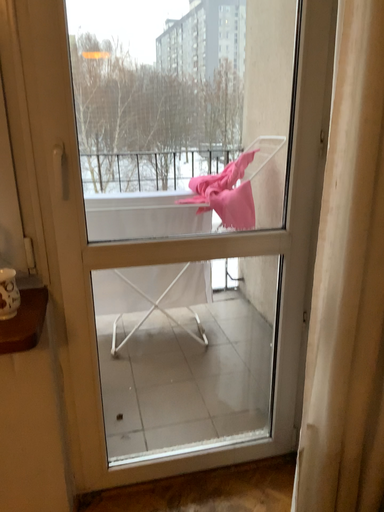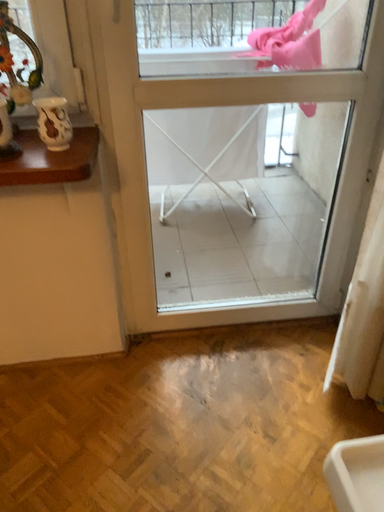
Question: How did the camera likely rotate when shooting the video?

Choices:
 (A) rotated downward
 (B) rotated upward

Answer: (A)